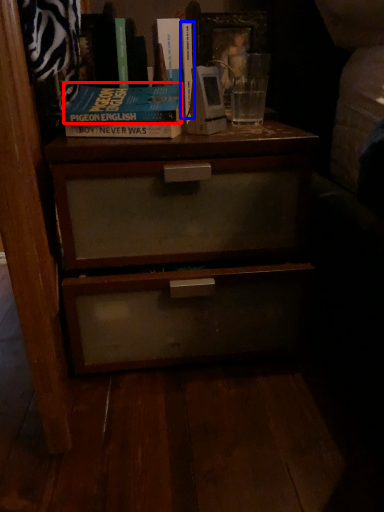
Question: Among these objects, which one is farthest to the camera, paperback book (highlighted by a red box) or book (highlighted by a blue box)?

Choices:
 (A) paperback book
 (B) book

Answer: (B)